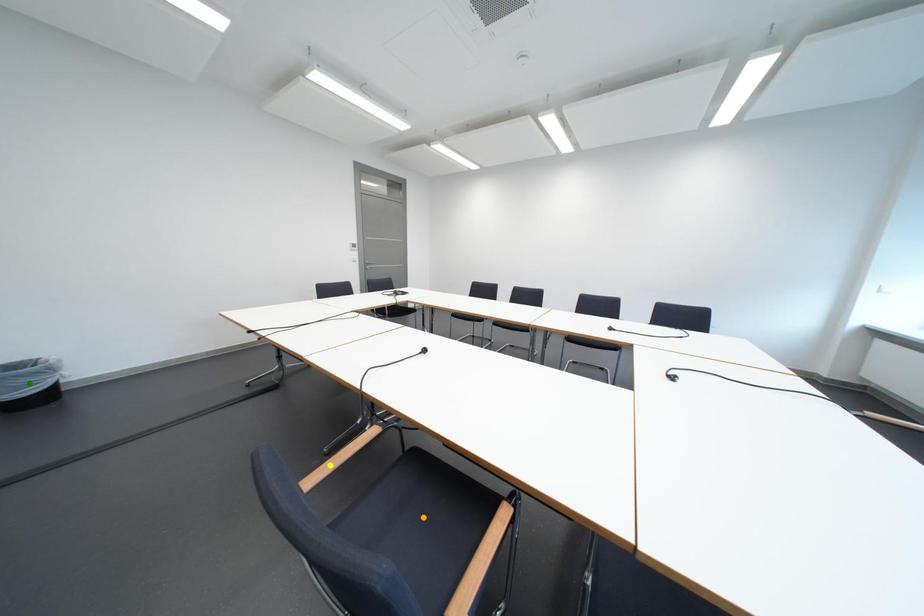
Order these from nearest to farthest:
yellow point, green point, orange point

green point < orange point < yellow point